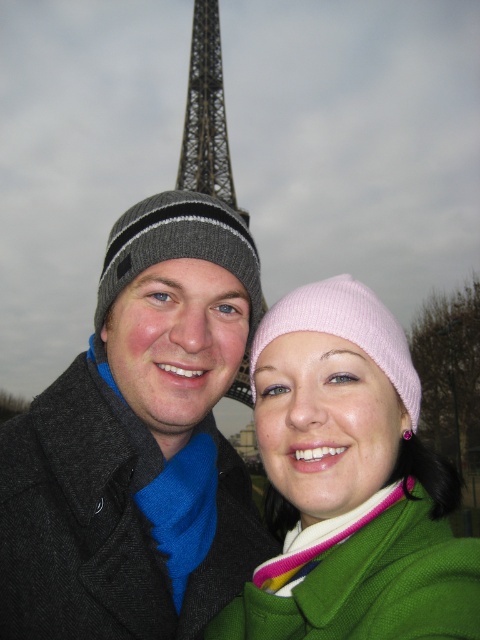
You are a photographer standing at the camera position. You want to take a photo of the dark gray knit hat at left. However, you notice that the hat is too small in the frame. What should you do to make the hat appear larger in your photo?

To make the dark gray knit hat at left appear larger in the photo, you should move closer to it since the hat is currently 133.05 meters away from the camera. Reducing the distance between the camera and the hat will increase its size in the frame.

You are a photographer trying to capture a photo of the two people and the Eiffel Tower. Based on their positions, will the pink knit beanie at center be taller than the metallic lattice structure at upper center in the photo?

The pink knit beanie at center is taller than the metallic lattice structure at upper center, so yes, the pink knit beanie at center will appear taller than the metallic lattice structure at upper center in the photo.